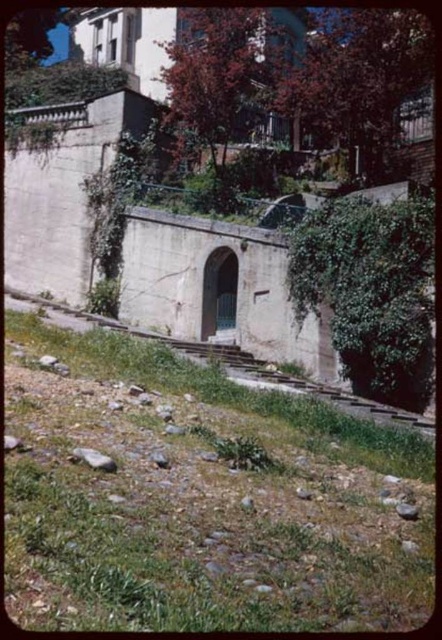
Between green grass at lower left and smooth gray rock at lower right, which one has less height?

smooth gray rock at lower right

Is green grass at lower left thinner than smooth gray rock at lower right?

No.

What do you see at coordinates (198, 499) in the screenshot?
I see `green grass at lower left` at bounding box center [198, 499].

The image size is (442, 640). What are the coordinates of `green grass at lower left` in the screenshot? It's located at (198, 499).